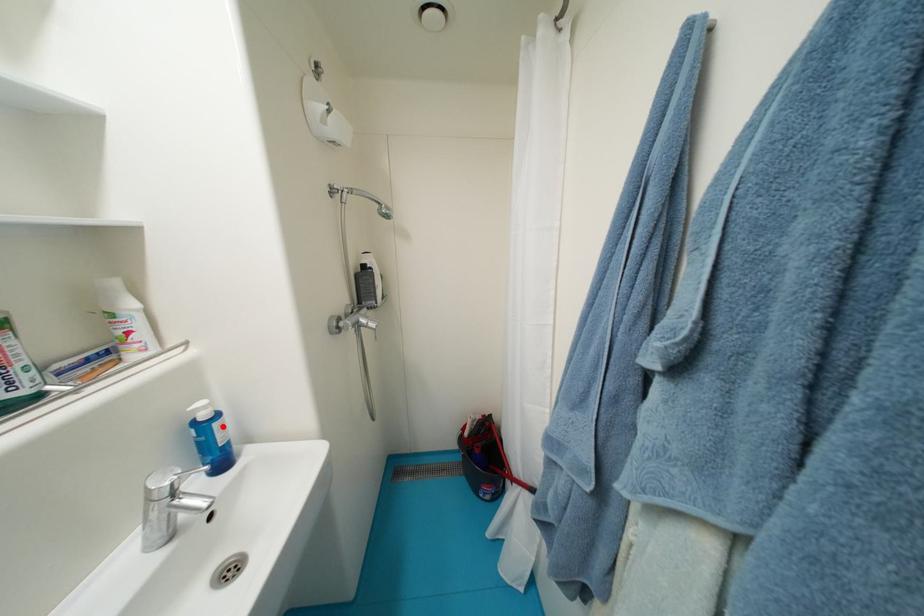
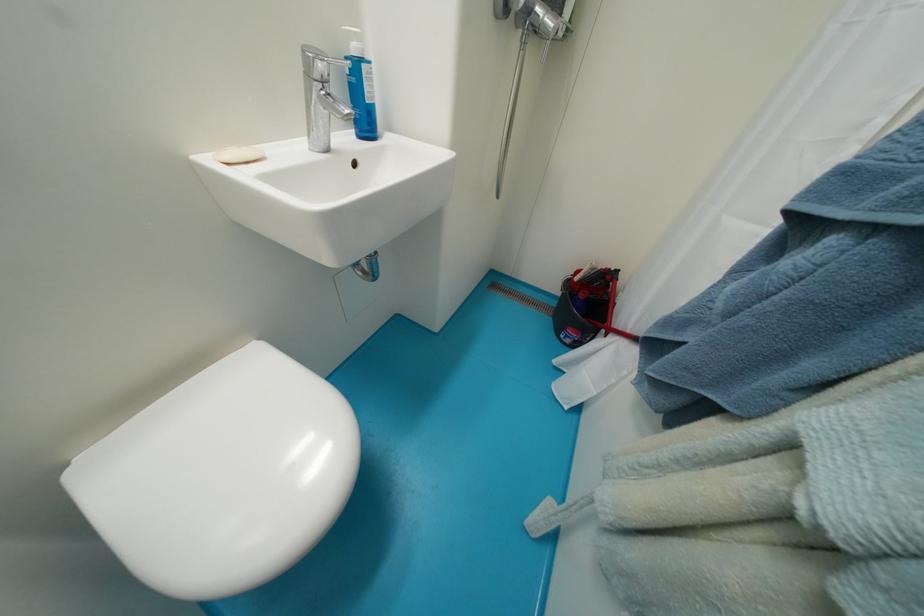
Question: I am providing you with two images of the same scene from different viewpoints. A red point is marked on the first image. Is the red point's position out of view in image 2?

Choices:
 (A) Yes
 (B) No

Answer: (B)